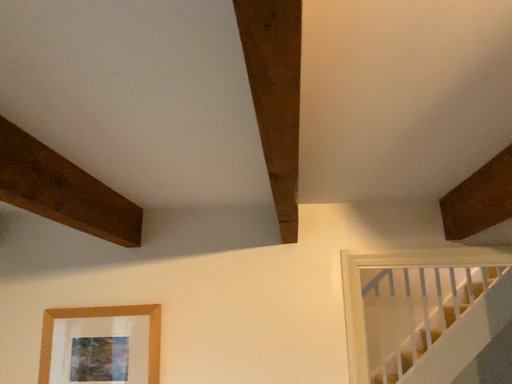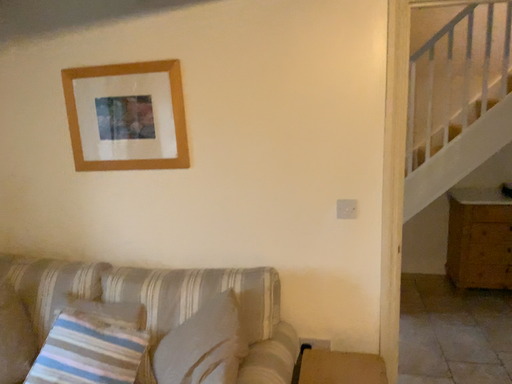
Question: How did the camera likely rotate when shooting the video?

Choices:
 (A) rotated left
 (B) rotated right

Answer: (A)